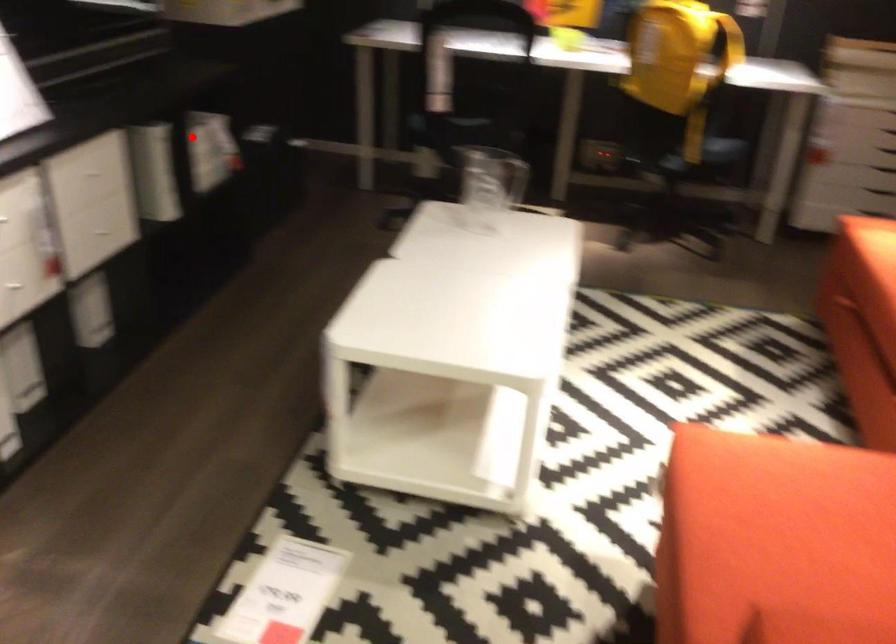
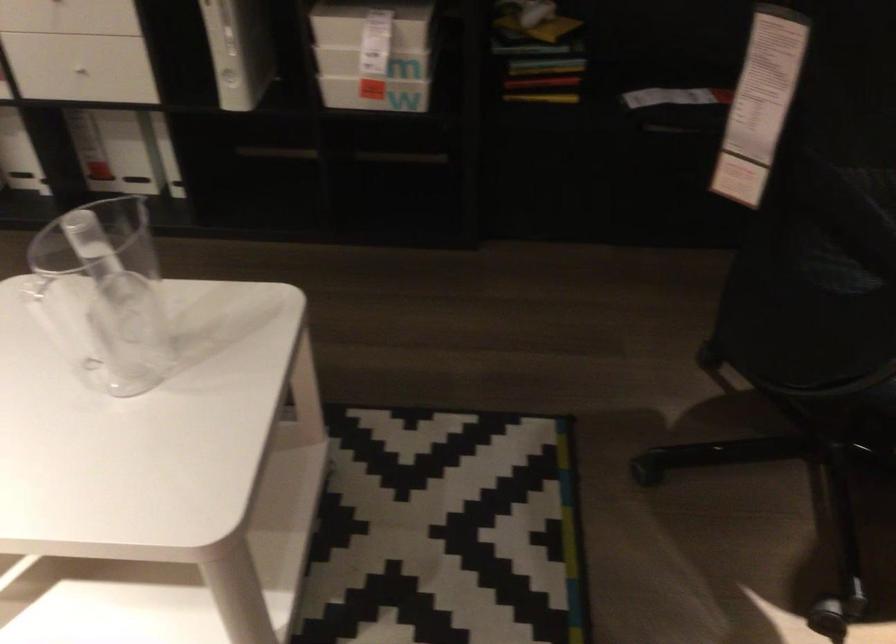
Locate, in the second image, the point that corresponds to the highlighted location in the first image.

(371, 24)